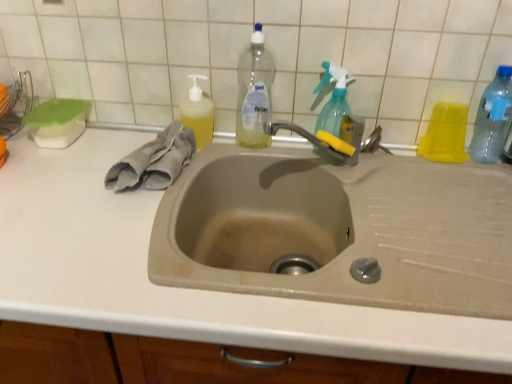
Question: From the image's perspective, is clear plastic bottle at upper center, which is the 1th bottle from left to right, above or below yellow rubber tap at upper center?

Choices:
 (A) below
 (B) above

Answer: (B)

Question: Considering the positions of point (257, 124) and point (330, 134), is point (257, 124) closer or farther from the camera than point (330, 134)?

Choices:
 (A) farther
 (B) closer

Answer: (A)

Question: Which object is positioned closest to the transparent plastic bottle at right, which appears as the first bottle when viewed from the right?

Choices:
 (A) yellow translucent liquid at upper left, which is the second cleaning product in right-to-left order
 (B) gray cotton hand towel at left
 (C) beige matte sink at center
 (D) white tile at upper center
 (E) yellow rubber tap at upper center

Answer: (E)

Question: Considering the real-world distances, which object is farthest from the transparent plastic bottle at right, the third bottle when ordered from left to right?

Choices:
 (A) white tile at upper center
 (B) beige matte sink at center
 (C) gray cotton hand towel at left
 (D) yellow rubber tap at upper center
 (E) clear plastic bottle at upper center, arranged as the 3th bottle when viewed from the right

Answer: (B)